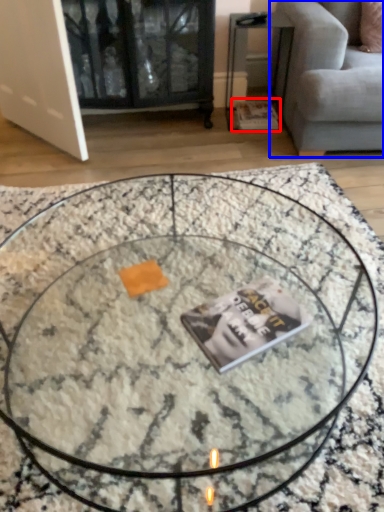
Question: Which object is further to the camera taking this photo, magazine (highlighted by a red box) or studio couch (highlighted by a blue box)?

Choices:
 (A) magazine
 (B) studio couch

Answer: (A)